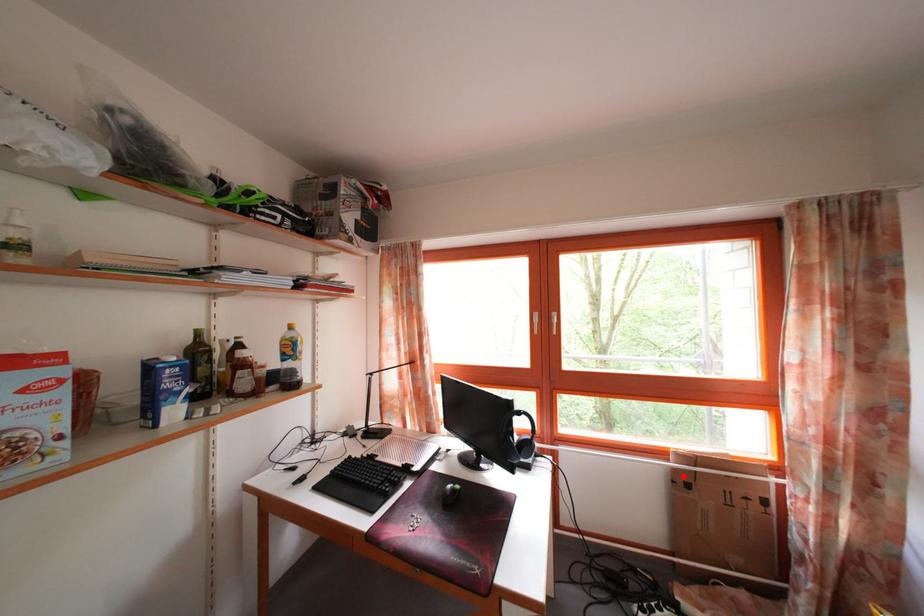
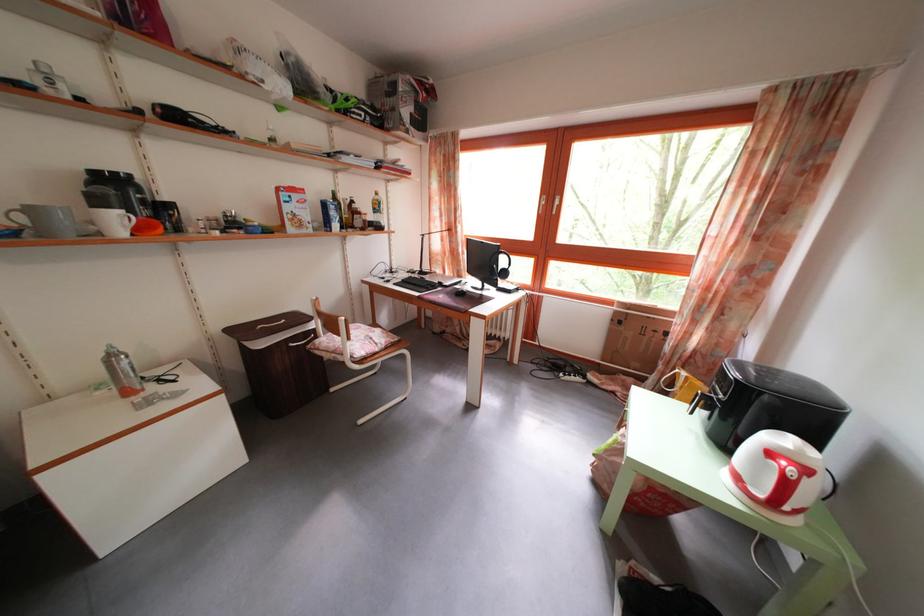
Question: I am providing you with two images of the same scene from different viewpoints. In image1, a red point is highlighted. Considering the same 3D point in image2, which of the following is correct?

Choices:
 (A) It is closer
 (B) It is farther

Answer: (A)